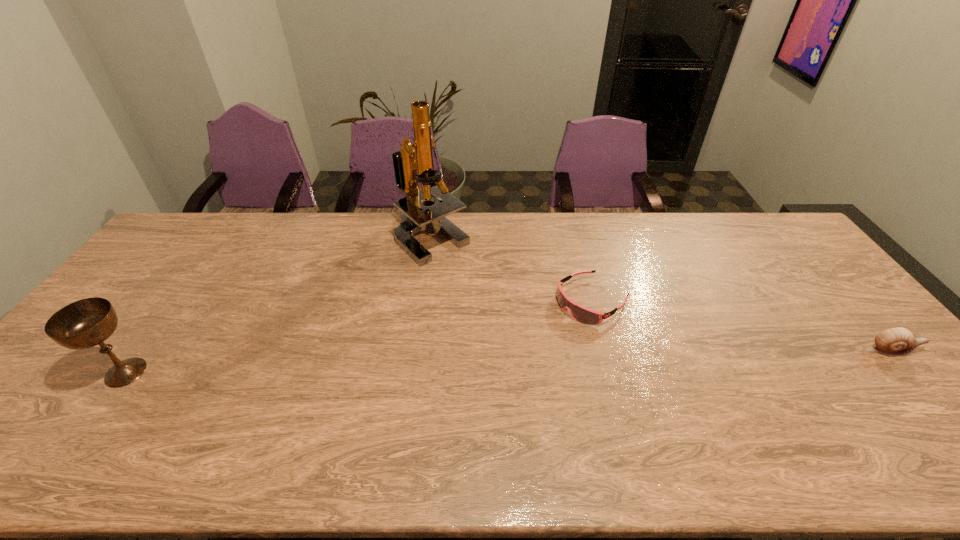
Find the location of `vacant space that is in between the second object from left to right and the chalice`. vacant space that is in between the second object from left to right and the chalice is located at coordinates (278, 306).

Image resolution: width=960 pixels, height=540 pixels. Identify the location of vacant region between the second farthest object and the tallest object. (512, 269).

Locate an element on the screen. free spot between the second farthest object and the chalice is located at coordinates (359, 336).

Find the location of a particular element. This screenshot has height=540, width=960. free space between the rightmost object and the farthest object is located at coordinates (661, 294).

Where is `free space between the shortest object and the leftmost object`? This screenshot has width=960, height=540. free space between the shortest object and the leftmost object is located at coordinates (359, 336).

Where is `free spot between the rightmost object and the microscope`? free spot between the rightmost object and the microscope is located at coordinates (661, 294).

Select which object is the third closest to the goggles. Please provide its 2D coordinates. Your answer should be formatted as a tuple, i.e. [(x, y)], where the tuple contains the x and y coordinates of a point satisfying the conditions above.

[(85, 323)]

Point out which object is positioned as the third nearest to the shortest object. Please provide its 2D coordinates. Your answer should be formatted as a tuple, i.e. [(x, y)], where the tuple contains the x and y coordinates of a point satisfying the conditions above.

[(85, 323)]

This screenshot has width=960, height=540. I want to click on vacant area in the image that satisfies the following two spatial constraints: 1. on the front side of the farthest object; 2. on the front-facing side of the second shortest object, so click(416, 350).

Where is `vacant space that satisfies the following two spatial constraints: 1. on the back side of the second object from right to left; 2. on the right side of the second tallest object`? This screenshot has height=540, width=960. vacant space that satisfies the following two spatial constraints: 1. on the back side of the second object from right to left; 2. on the right side of the second tallest object is located at coordinates (178, 301).